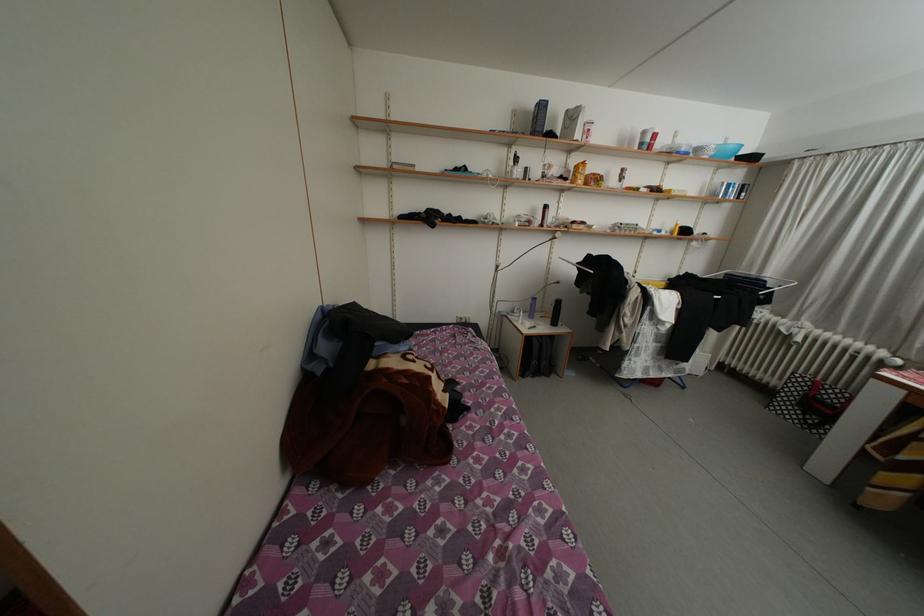
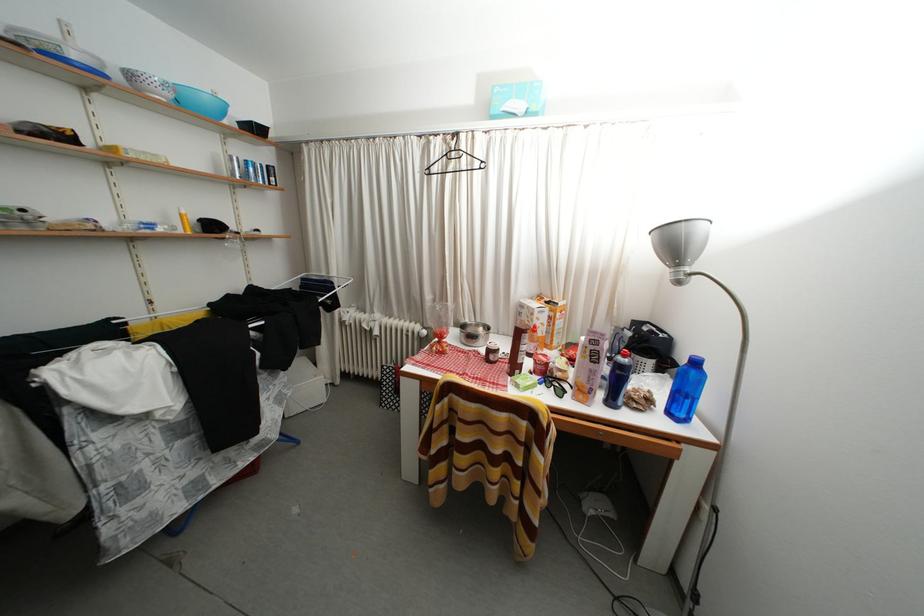
In the second image, find the point that corresponds to (721,159) in the first image.

(178, 100)